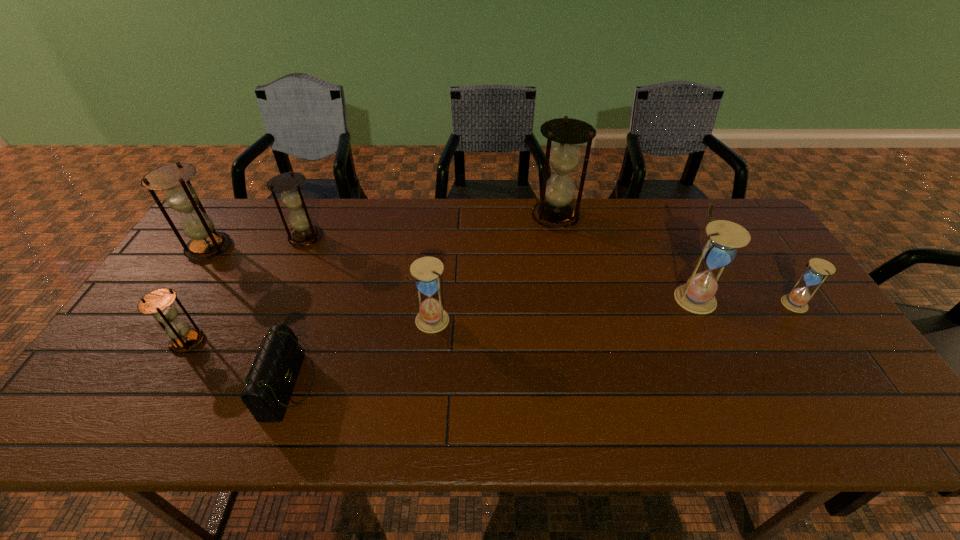
Find the location of `hourglass that is the nearest to the biggest white hourglass`. hourglass that is the nearest to the biggest white hourglass is located at coordinates (818, 269).

Identify the location of hourglass that is the closest to the second biggest brown hourglass. (288, 184).

This screenshot has height=540, width=960. Find the location of `brown hourglass that is the second closest to the biggest brown hourglass`. brown hourglass that is the second closest to the biggest brown hourglass is located at coordinates 206,242.

Identify which brown hourglass is located as the second nearest to the second biggest brown hourglass. Please provide its 2D coordinates. Your answer should be formatted as a tuple, i.e. [(x, y)], where the tuple contains the x and y coordinates of a point satisfying the conditions above.

[(159, 303)]

This screenshot has height=540, width=960. I want to click on white hourglass that is the nearest to the smallest white hourglass, so click(x=698, y=294).

You are a GUI agent. You are given a task and a screenshot of the screen. Output one action in this format:
    pyautogui.click(x=<x>, y=<y>)
    Task: Click on the white hourglass identified as the second closest to the leftmost white hourglass
    The image size is (960, 540).
    Given the screenshot: What is the action you would take?
    pyautogui.click(x=818, y=269)

Where is `vacant space that satisfies the following two spatial constraints: 1. on the front side of the biggest white hourglass; 2. on the front flap of the shortest object`? vacant space that satisfies the following two spatial constraints: 1. on the front side of the biggest white hourglass; 2. on the front flap of the shortest object is located at coordinates (736, 386).